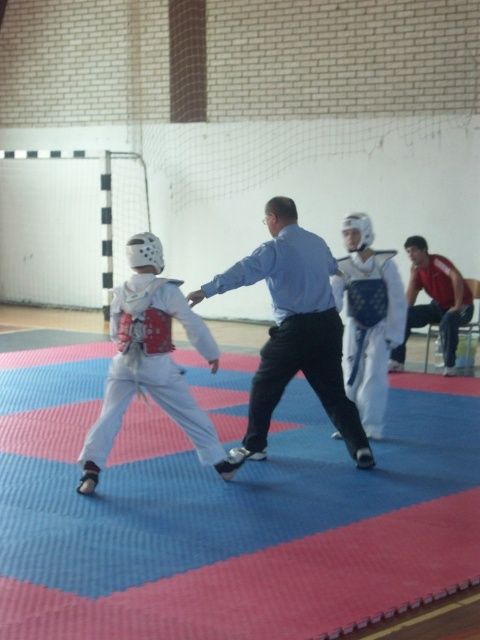
Question: Can you confirm if blue shirt at center is smaller than white matte karate uniform at left?

Choices:
 (A) yes
 (B) no

Answer: (B)

Question: Is white matte uniform at center to the left of red fabric shirt at right from the viewer's perspective?

Choices:
 (A) yes
 (B) no

Answer: (A)

Question: Considering the real-world distances, which object is closest to the blue rubber mat at center?

Choices:
 (A) blue shirt at center
 (B) white matte uniform at center
 (C) red fabric shirt at right

Answer: (A)

Question: Based on their relative distances, which object is farther from the red fabric shirt at right?

Choices:
 (A) blue shirt at center
 (B) blue rubber mat at center

Answer: (B)

Question: Is the position of blue shirt at center more distant than that of red fabric shirt at right?

Choices:
 (A) yes
 (B) no

Answer: (B)

Question: Which point is farther to the camera?

Choices:
 (A) (352, 269)
 (B) (315, 260)
 (C) (8, 504)
 (D) (452, 355)

Answer: (D)